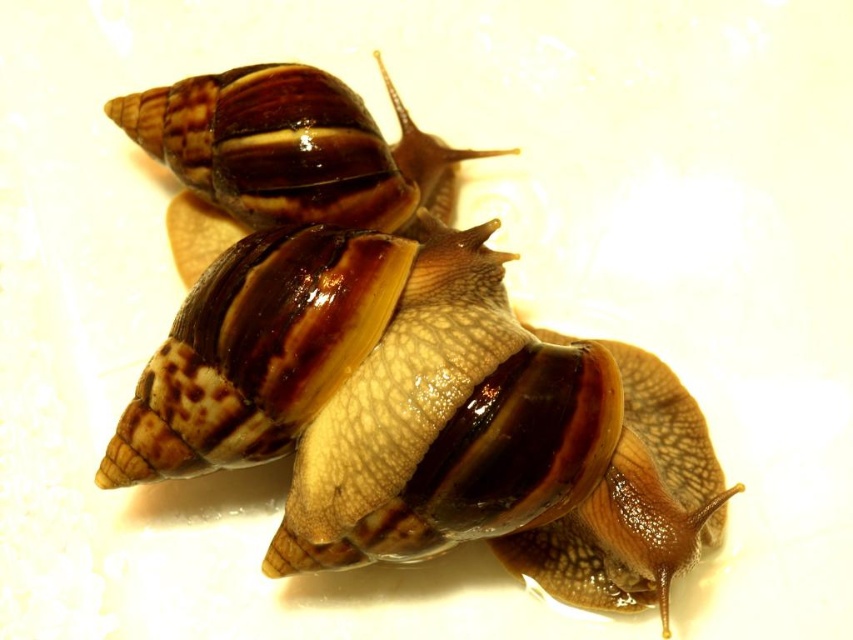
You are a chef preparing a dish and need to place the brown shiny shell at center and the shiny brown shell at upper center on a small plate. Which shell should you place first to ensure the one behind is fully visible?

You should place the shiny brown shell at upper center first because the brown shiny shell at center is in front of it, so placing the one behind first allows the front shell to be placed over it and still be visible.